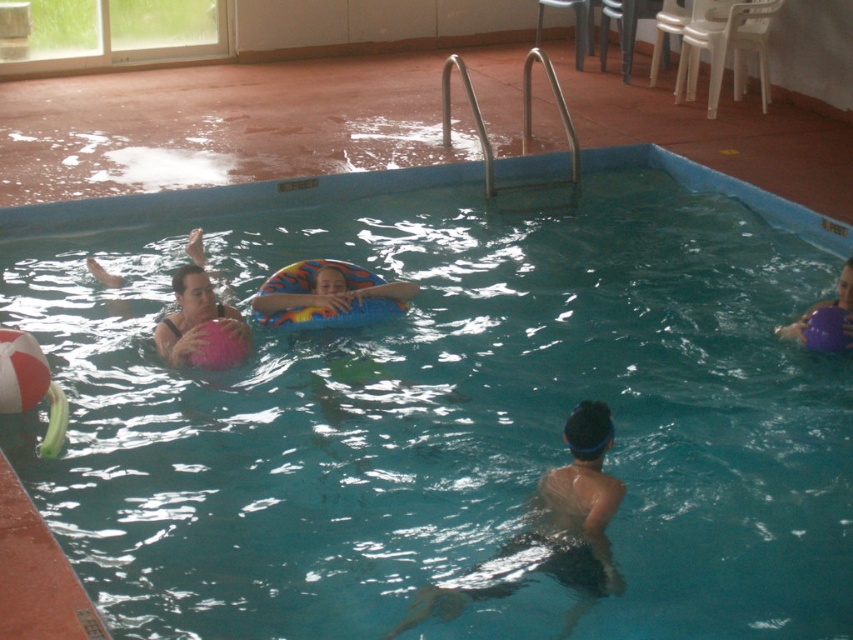
Who is lower down, black rubber swim cap at center or pink matte ball at center?

black rubber swim cap at center is lower down.

Does black rubber swim cap at center appear under pink matte ball at center?

Yes, black rubber swim cap at center is below pink matte ball at center.

Identify the location of black rubber swim cap at center. The height and width of the screenshot is (640, 853). (577, 508).

The image size is (853, 640). I want to click on black rubber swim cap at center, so (x=577, y=508).

What do you see at coordinates (196, 320) in the screenshot? I see `pink matte ball at center` at bounding box center [196, 320].

From the picture: Is pink matte ball at center further to camera compared to purple rubber ball at right?

No, it is in front of purple rubber ball at right.

Image resolution: width=853 pixels, height=640 pixels. Describe the element at coordinates (196, 320) in the screenshot. I see `pink matte ball at center` at that location.

The width and height of the screenshot is (853, 640). Identify the location of pink matte ball at center. (196, 320).

This screenshot has height=640, width=853. Describe the element at coordinates (326, 291) in the screenshot. I see `multicolored rubber ring at center` at that location.

Which is above, multicolored rubber ring at center or purple rubber ball at right?

multicolored rubber ring at center

Does point (294, 262) come behind point (839, 333)?

Yes, it is.

Locate an element on the screen. This screenshot has height=640, width=853. multicolored rubber ring at center is located at coordinates (326, 291).